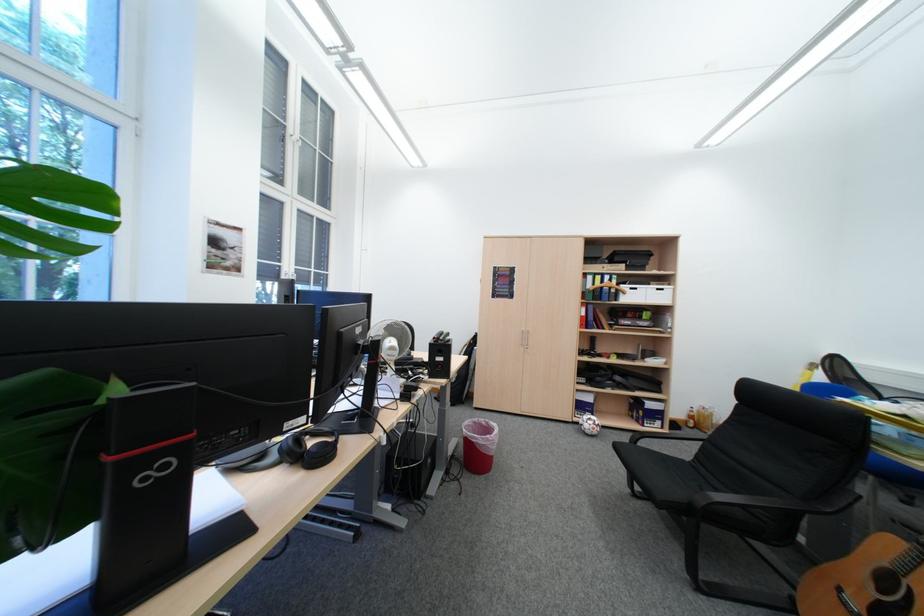
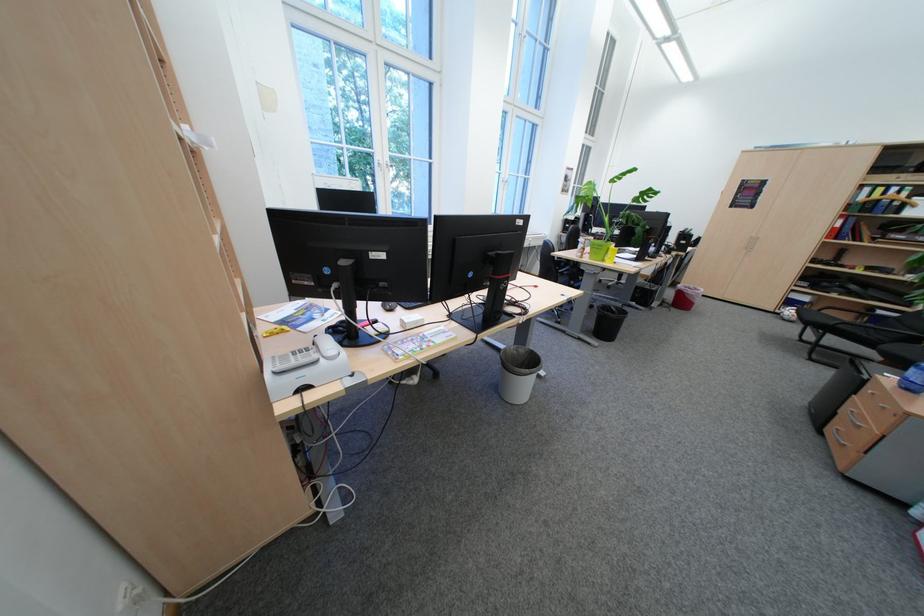
In the second image, find the point that corresponds to [488,461] in the first image.

(694, 302)